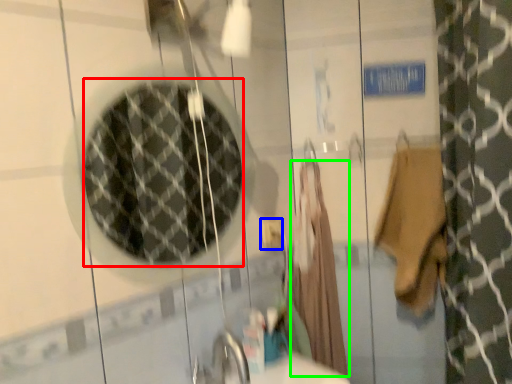
Question: Which object is positioned closest to mirror (highlighted by a red box)? Select from electric outlet (highlighted by a blue box) and robe (highlighted by a green box).

Choices:
 (A) electric outlet
 (B) robe

Answer: (B)